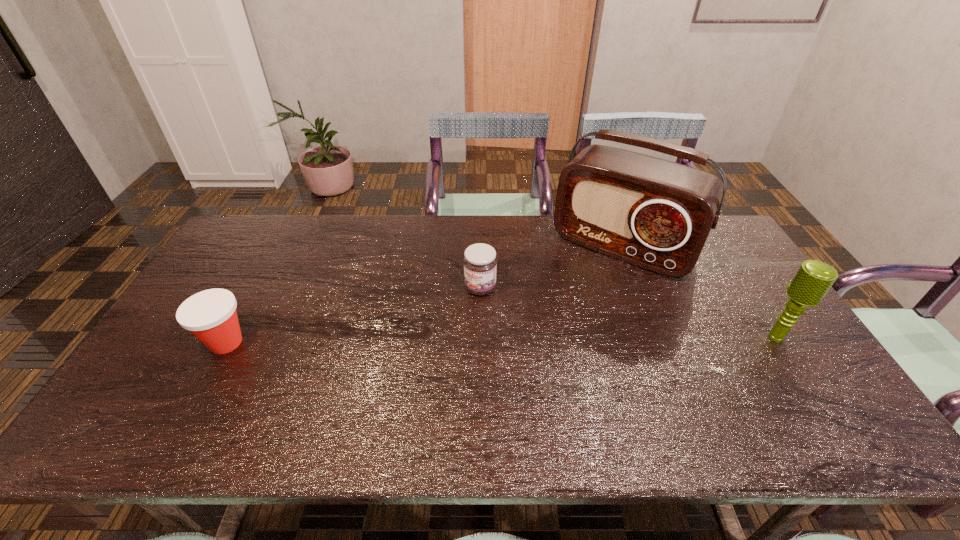
This screenshot has height=540, width=960. What are the coordinates of `vacant region located on the front panel of the tallest object` in the screenshot? It's located at (566, 321).

The width and height of the screenshot is (960, 540). I want to click on vacant space located on the front label of the second object from left to right, so click(452, 334).

The width and height of the screenshot is (960, 540). I want to click on vacant region located 0.350m on the front label of the second object from left to right, so click(417, 391).

I want to click on vacant space located on the front label of the second object from left to right, so click(x=464, y=314).

The image size is (960, 540). What are the coordinates of `object that is positioned at the far edge` in the screenshot? It's located at (656, 214).

This screenshot has height=540, width=960. In order to click on object situated at the left edge in this screenshot , I will do `click(210, 315)`.

Identify the location of microphone located in the right edge section of the desktop. The image size is (960, 540). (813, 279).

I want to click on radio receiver present at the right edge, so click(656, 214).

At what (x,y) coordinates should I click in order to perform the action: click on object present at the far right corner. Please return your answer as a coordinate pair (x, y). The image size is (960, 540). Looking at the image, I should click on (656, 214).

In the image, there is a desktop. In order to click on free region at the far edge in this screenshot , I will do `click(453, 239)`.